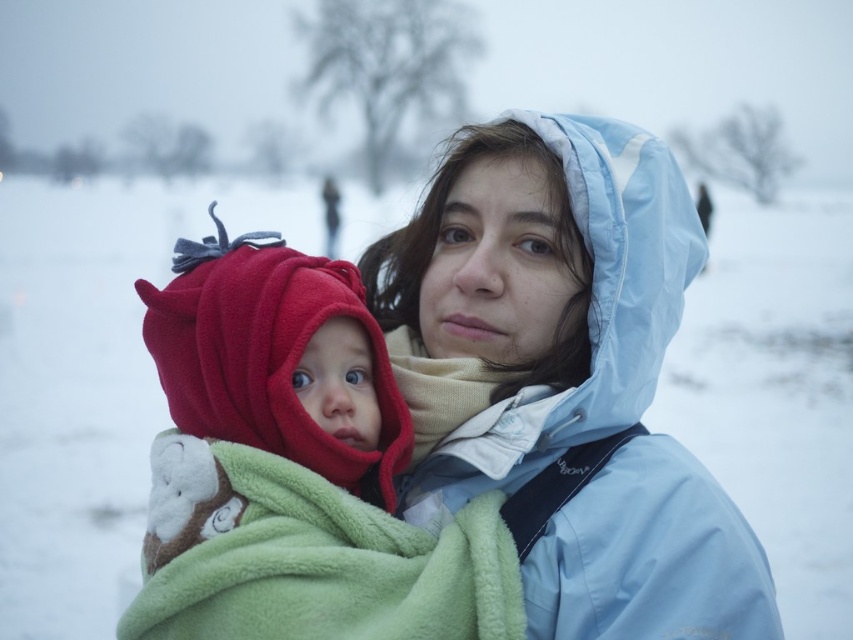
Who is more distant from viewer, (264, 332) or (186, 515)?

Point (264, 332)

Between fuzzy red hood at center and green fleece blanket at center, which one appears on the left side from the viewer's perspective?

fuzzy red hood at center

Does point (376, 547) come closer to viewer compared to point (419, 579)?

No, it is not.

Locate an element on the screen. The height and width of the screenshot is (640, 853). fuzzy red hood at center is located at coordinates (291, 474).

Is the position of light blue waterproof jacket at center less distant than that of green fleece blanket at center?

That is False.

At what (x,y) coordinates should I click in order to perform the action: click on light blue waterproof jacket at center. Please return your answer as a coordinate pair (x, y). This screenshot has height=640, width=853. Looking at the image, I should click on (531, 300).

The width and height of the screenshot is (853, 640). Identify the location of light blue waterproof jacket at center. (531, 300).

Does white fluffy snow at center appear on the right side of fuzzy fleece hat at left?

In fact, white fluffy snow at center is to the left of fuzzy fleece hat at left.

Which is behind, point (738, 408) or point (218, 364)?

Positioned behind is point (738, 408).

Between point (99, 362) and point (189, 284), which one is positioned behind?

Point (99, 362)

Find the location of `white fluffy snow at center`. white fluffy snow at center is located at coordinates (91, 378).